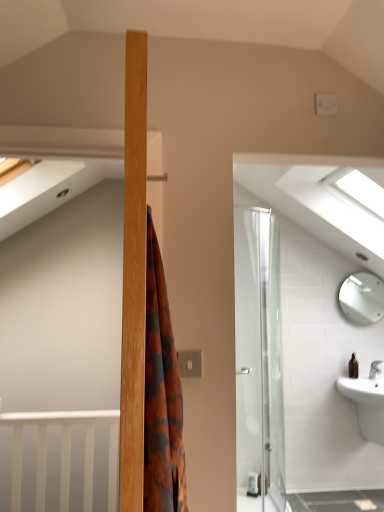
Where is `brown glass bottle at lower right`? brown glass bottle at lower right is located at coordinates (353, 367).

Which object is positioned more to the left, white glossy mirror at upper right or transparent glass window at upper right?

From the viewer's perspective, transparent glass window at upper right appears more on the left side.

Is point (367, 321) farther from viewer compared to point (337, 168)?

Yes, point (367, 321) is behind point (337, 168).

How different are the orientations of white glossy mirror at upper right and transparent glass window at upper right in degrees?

There is a 91.8-degree angle between the facing directions of white glossy mirror at upper right and transparent glass window at upper right.

From the image's perspective, would you say white glossy mirror at upper right is positioned over transparent glass window at upper right?

No, from the image's perspective, white glossy mirror at upper right is not over transparent glass window at upper right.

Is brown glass bottle at lower right oriented towards transparent glass window at upper right?

No, brown glass bottle at lower right is not turned towards transparent glass window at upper right.

Which is less distant, (349,360) or (349,183)?

The point (349,183) is in front.

Is brown glass bottle at lower right bigger than transparent glass window at upper right?

Actually, brown glass bottle at lower right might be smaller than transparent glass window at upper right.

Who is shorter, brown glass bottle at lower right or transparent glass window at upper right?

With less height is brown glass bottle at lower right.

Is brown glass bottle at lower right in contact with white glossy sink at lower right?

No, brown glass bottle at lower right is not making contact with white glossy sink at lower right.

Between brown glass bottle at lower right and white glossy sink at lower right, which one is positioned behind?

brown glass bottle at lower right is further away from the camera.

From the image's perspective, between brown glass bottle at lower right and white glossy sink at lower right, who is located below?

white glossy sink at lower right is shown below in the image.

What are the coordinates of `toiletry that is behind the white glossy sink at lower right` in the screenshot? It's located at (353, 367).

How different are the orientations of transparent glass window at upper right and white glossy mirror at upper right in degrees?

They differ by 91.8 degrees in their facing directions.

Could you tell me if transparent glass window at upper right is turned towards white glossy mirror at upper right?

No.

Choose the correct answer: Is transparent glass window at upper right inside white glossy mirror at upper right or outside it?

transparent glass window at upper right is spatially situated outside white glossy mirror at upper right.

Would you consider white glossy mirror at upper right to be distant from brown glass bottle at lower right?

white glossy mirror at upper right is far away from brown glass bottle at lower right.

Is point (355, 279) positioned before point (356, 374)?

No, it is behind (356, 374).

Is white glossy mirror at upper right positioned beyond the bounds of brown glass bottle at lower right?

white glossy mirror at upper right lies outside brown glass bottle at lower right's area.

The image size is (384, 512). In the image, there is a white glossy mirror at upper right. Identify the location of toiletry below it (from the image's perspective). (353, 367).

Which of these two, brown glass bottle at lower right or white glossy mirror at upper right, stands taller?

Standing taller between the two is white glossy mirror at upper right.

This screenshot has width=384, height=512. I want to click on mirror that appears behind the brown glass bottle at lower right, so click(362, 298).

Can you confirm if brown glass bottle at lower right is thinner than white glossy mirror at upper right?

No.

From a real-world perspective, which object stands above the other?

white glossy mirror at upper right is physically above.

Can you confirm if white glossy mirror at upper right is bigger than white glossy sink at lower right?

Actually, white glossy mirror at upper right might be smaller than white glossy sink at lower right.

How many degrees apart are the facing directions of white glossy mirror at upper right and white glossy sink at lower right?

There is a 0.00636-degree angle between the facing directions of white glossy mirror at upper right and white glossy sink at lower right.

Locate an element on the screen. This screenshot has width=384, height=512. mirror above the white glossy sink at lower right (from a real-world perspective) is located at coordinates (362, 298).

Is white glossy mirror at upper right turned away from white glossy sink at lower right?

No, white glossy sink at lower right is not at the back of white glossy mirror at upper right.

You are a GUI agent. You are given a task and a screenshot of the screen. Output one action in this format:
    pyautogui.click(x=<x>, y=<y>)
    Task: Click on the mirror that appears below the transparent glass window at upper right (from the image's perspective)
    The width and height of the screenshot is (384, 512).
    Given the screenshot: What is the action you would take?
    pyautogui.click(x=362, y=298)

At what (x,y) coordinates should I click in order to perform the action: click on window in front of the brown glass bottle at lower right. Please return your answer as a coordinate pair (x, y). The height and width of the screenshot is (512, 384). Looking at the image, I should click on (357, 189).

Based on their spatial positions, is white glossy mirror at upper right or white glossy sink at lower right further from transparent glass window at upper right?

Based on the image, white glossy mirror at upper right appears to be further to transparent glass window at upper right.

When comparing their distances from brown glass bottle at lower right, does transparent glass window at upper right or white glossy sink at lower right seem further?

transparent glass window at upper right.

Looking at the image, which one is located further to transparent glass window at upper right, white glossy sink at lower right or brown glass bottle at lower right?

white glossy sink at lower right lies further to transparent glass window at upper right than the other object.

Looking at the image, which one is located further to brown glass bottle at lower right, white glossy mirror at upper right or transparent glass window at upper right?

Based on the image, transparent glass window at upper right appears to be further to brown glass bottle at lower right.

Looking at the image, which one is located further to white glossy mirror at upper right, brown glass bottle at lower right or transparent glass window at upper right?

transparent glass window at upper right is further to white glossy mirror at upper right.

Which object lies nearer to the anchor point white glossy mirror at upper right, transparent glass window at upper right or white glossy sink at lower right?

white glossy sink at lower right lies closer to white glossy mirror at upper right than the other object.

Based on their spatial positions, is white glossy sink at lower right or white glossy mirror at upper right closer to brown glass bottle at lower right?

white glossy sink at lower right is positioned closer to the anchor brown glass bottle at lower right.

Estimate the real-world distances between objects in this image. Which object is further from white glossy sink at lower right, white glossy mirror at upper right or transparent glass window at upper right?

transparent glass window at upper right lies further to white glossy sink at lower right than the other object.

Where is `mirror that lies between transparent glass window at upper right and white glossy sink at lower right from top to bottom`? Image resolution: width=384 pixels, height=512 pixels. mirror that lies between transparent glass window at upper right and white glossy sink at lower right from top to bottom is located at coordinates (362, 298).

Identify the location of toiletry between white glossy mirror at upper right and white glossy sink at lower right vertically. click(353, 367).

Find the location of a particular element. mirror between transparent glass window at upper right and brown glass bottle at lower right from top to bottom is located at coordinates coord(362,298).

What are the coordinates of `toiletry between transparent glass window at upper right and white glossy sink at lower right vertically` in the screenshot? It's located at (353, 367).